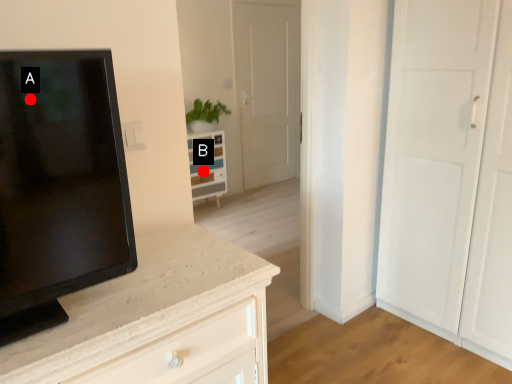
Question: Two points are circled on the image, labeled by A and B beside each circle. Among these points, which one is nearest to the camera?

Choices:
 (A) A is closer
 (B) B is closer

Answer: (A)